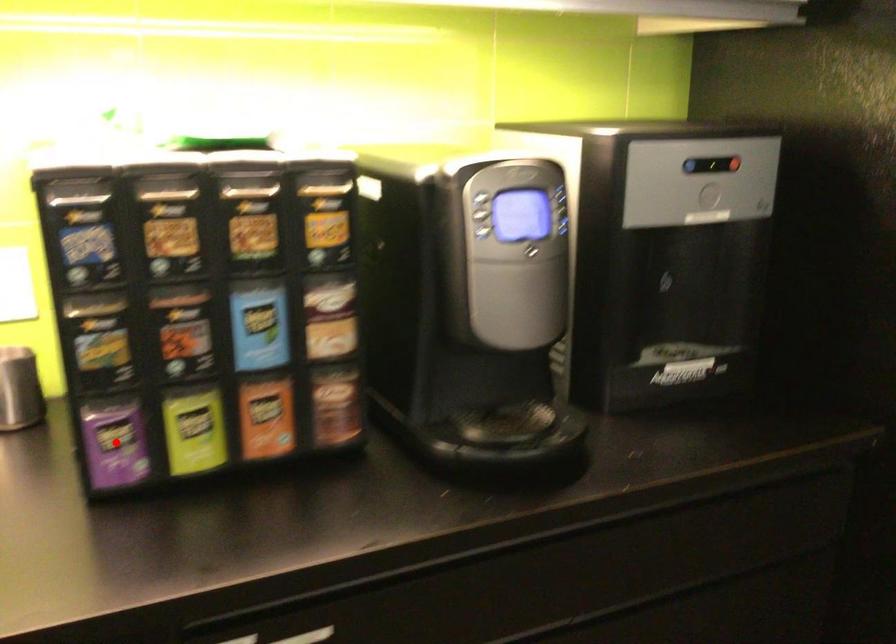
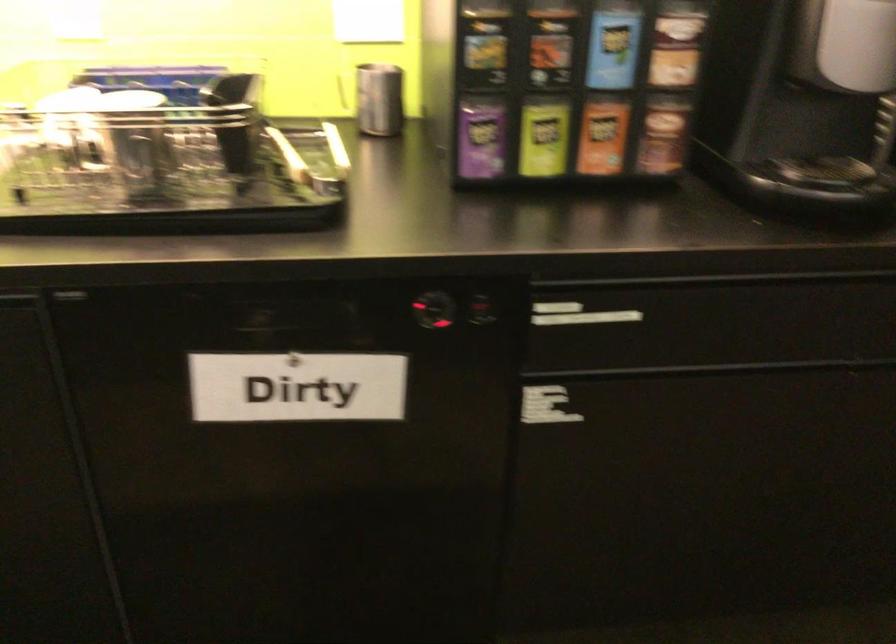
In the second image, find the point that corresponds to the highlighted location in the first image.

(479, 138)